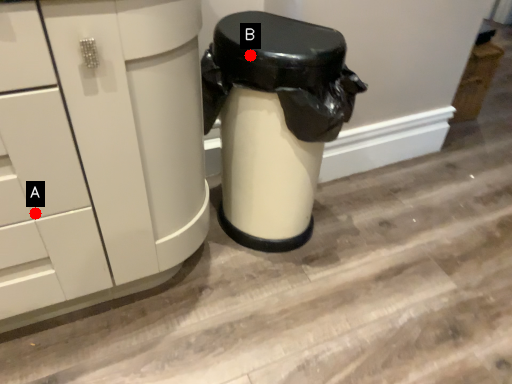
Question: Two points are circled on the image, labeled by A and B beside each circle. Which point is closer to the camera?

Choices:
 (A) A is closer
 (B) B is closer

Answer: (A)